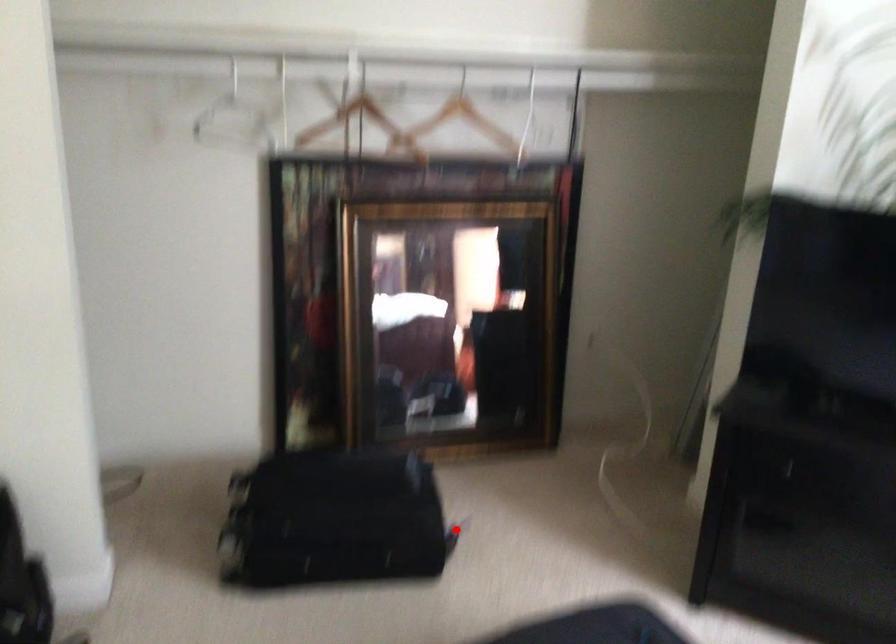
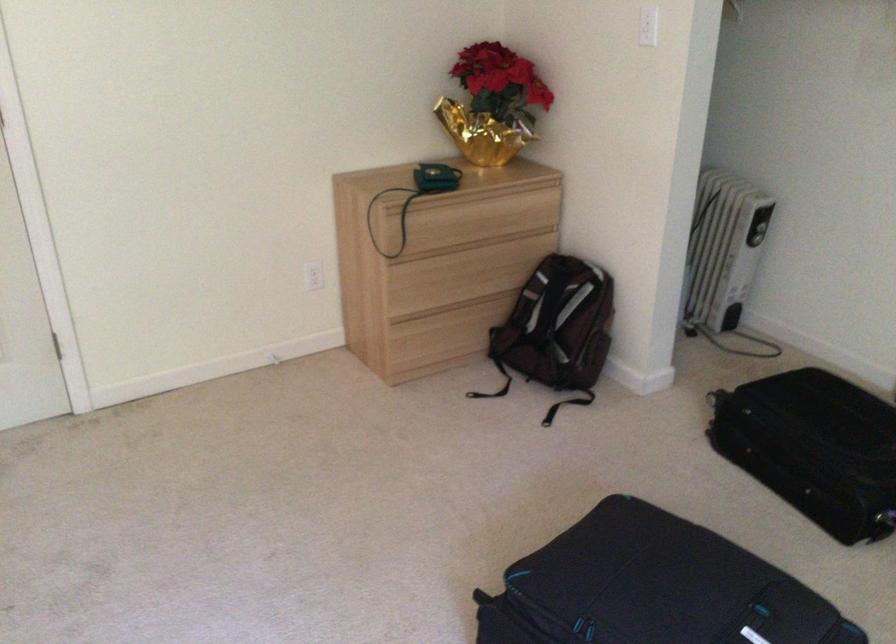
Question: I am providing you with two images of the same scene from different viewpoints. A red point is marked on the first image. Can you still see the location of the red point in image 2?

Choices:
 (A) Yes
 (B) No

Answer: (A)